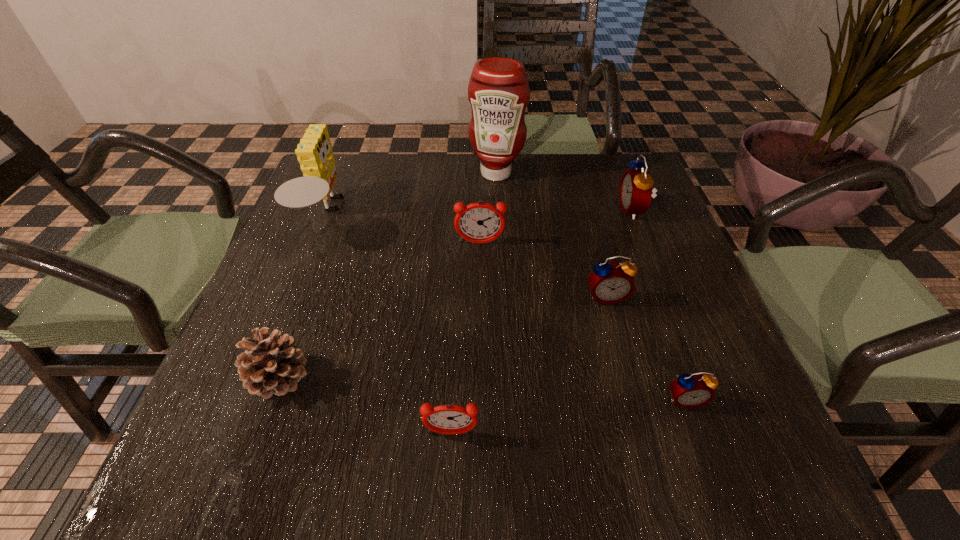
This screenshot has height=540, width=960. I want to click on free point between the tallest alarm clock and the nearest alarm clock, so click(542, 322).

At what (x,y) coordinates should I click in order to perform the action: click on vacant space that is in between the brown pinecone and the farther reddish-pink alarm clock. Please return your answer as a coordinate pair (x, y). This screenshot has width=960, height=540. Looking at the image, I should click on (380, 310).

Identify the location of vacant area that lies between the nearest alarm clock and the seventh shortest object. click(389, 323).

Locate an element on the screen. unoccupied position between the second tallest object and the third object from right to left is located at coordinates (467, 255).

The image size is (960, 540). What are the coordinates of `vacant area that lies between the second smallest red alarm clock and the second farthest alarm clock` in the screenshot? It's located at (543, 269).

Image resolution: width=960 pixels, height=540 pixels. Identify the location of blank region between the tallest object and the smaller reddish-pink alarm clock. (473, 303).

Identify the location of free space between the biggest red alarm clock and the brown pinecone. The image size is (960, 540). (456, 294).

This screenshot has height=540, width=960. Identify the location of vacant space that's between the nearer reddish-pink alarm clock and the seventh shortest object. [389, 323].

The width and height of the screenshot is (960, 540). Identify the location of free area in between the fourth nearest object and the nearest object. (529, 364).

You are a GUI agent. You are given a task and a screenshot of the screen. Output one action in this format:
    pyautogui.click(x=<x>, y=<y>)
    Task: Click on the object that can be found as the third closest to the biggest red alarm clock
    
    Given the screenshot: What is the action you would take?
    pyautogui.click(x=479, y=222)